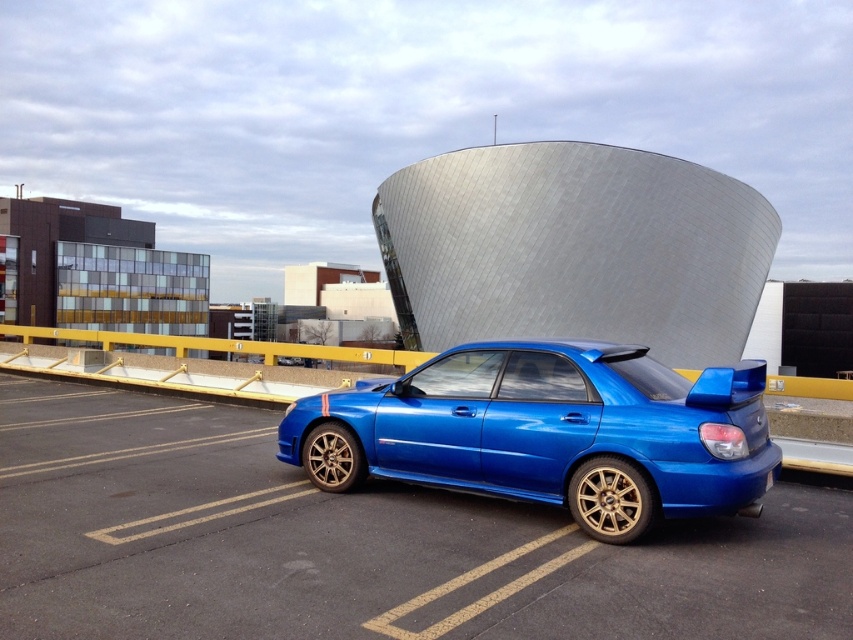
You are a parking attendant who needs to measure the distance between two cars in the parking lot. You see the metallic blue car at center and the glossy blue car at center. Can you confirm if the space between them is sufficient to fit a standard parking sensor probe that requires 1.2 meters of clearance?

The distance between the metallic blue car at center and the glossy blue car at center is 1.18 meters, which is slightly less than the required 1.2 meters. Therefore, the space is insufficient to fit the standard parking sensor probe.

You are a parking attendant and need to locate the metallic blue car at center. According to the parking system, the car is at coordinates point 0.852, 0.421. Can you confirm if this matches the car in the image?

Yes, the metallic blue car at center is indeed located at point (x=358, y=545) as per the parking system.

You are a photographer trying to capture both the metallic blue car at center and the glossy blue car at center in a single shot. Since you want to include the dome structure in the background, which car should you position closer to the dome to ensure both cars and the dome are in frame?

The metallic blue car at center is positioned on the left side of the glossy blue car at center. To include the dome structure in the background while capturing both cars, you should position the glossy blue car at center closer to the dome since it is on the right side relative to the metallic blue car.